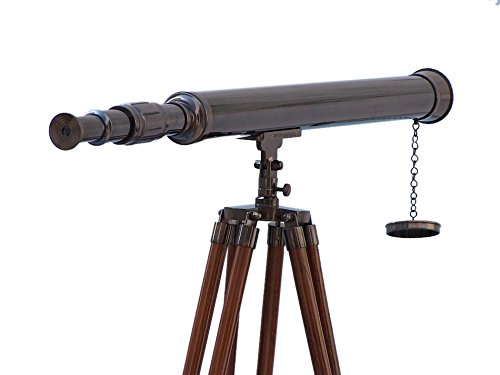
The height and width of the screenshot is (375, 500). What are the coordinates of `knob` in the screenshot? It's located at (283, 189).